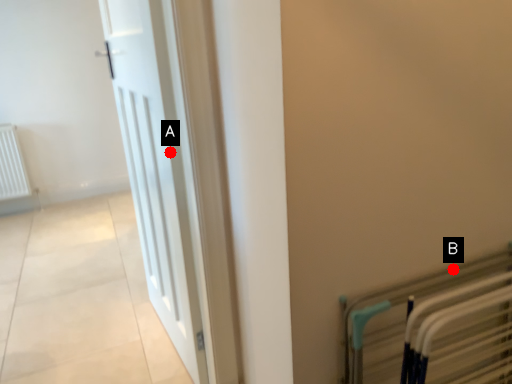
Question: Two points are circled on the image, labeled by A and B beside each circle. Which point is farther from the camera taking this photo?

Choices:
 (A) A is further
 (B) B is further

Answer: (A)